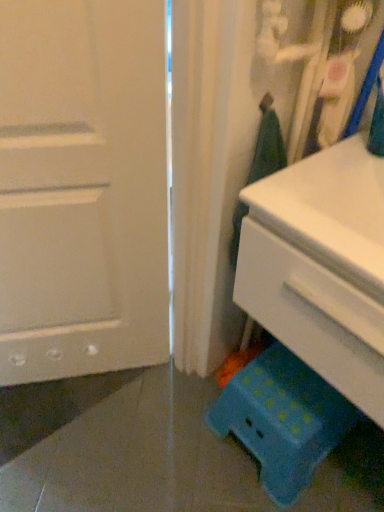
Question: From a real-world perspective, does white matte door at left sit lower than white plastic chest of drawers at lower right?

Choices:
 (A) yes
 (B) no

Answer: (A)

Question: Would you say white matte door at left is a long distance from white plastic chest of drawers at lower right?

Choices:
 (A) no
 (B) yes

Answer: (A)

Question: From the image's perspective, would you say white matte door at left is positioned over white plastic chest of drawers at lower right?

Choices:
 (A) yes
 (B) no

Answer: (A)

Question: Is white matte door at left outside of white plastic chest of drawers at lower right?

Choices:
 (A) yes
 (B) no

Answer: (A)

Question: Is white matte door at left shorter than white plastic chest of drawers at lower right?

Choices:
 (A) no
 (B) yes

Answer: (A)

Question: Is white matte door at left oriented towards white plastic chest of drawers at lower right?

Choices:
 (A) no
 (B) yes

Answer: (A)

Question: From the image's perspective, does blue polka dot plastic stool at lower right appear lower than white plastic chest of drawers at lower right?

Choices:
 (A) no
 (B) yes

Answer: (B)

Question: Considering the relative positions of blue polka dot plastic stool at lower right and white plastic chest of drawers at lower right in the image provided, is blue polka dot plastic stool at lower right to the left of white plastic chest of drawers at lower right from the viewer's perspective?

Choices:
 (A) no
 (B) yes

Answer: (B)

Question: Can you confirm if blue polka dot plastic stool at lower right is smaller than white plastic chest of drawers at lower right?

Choices:
 (A) no
 (B) yes

Answer: (B)

Question: Can you confirm if blue polka dot plastic stool at lower right is positioned to the right of white plastic chest of drawers at lower right?

Choices:
 (A) no
 (B) yes

Answer: (A)

Question: From a real-world perspective, is blue polka dot plastic stool at lower right on top of white plastic chest of drawers at lower right?

Choices:
 (A) no
 (B) yes

Answer: (A)

Question: From a real-world perspective, is blue polka dot plastic stool at lower right located beneath white plastic chest of drawers at lower right?

Choices:
 (A) yes
 (B) no

Answer: (A)

Question: From the image's perspective, does white plastic chest of drawers at lower right appear lower than blue polka dot plastic stool at lower right?

Choices:
 (A) no
 (B) yes

Answer: (A)